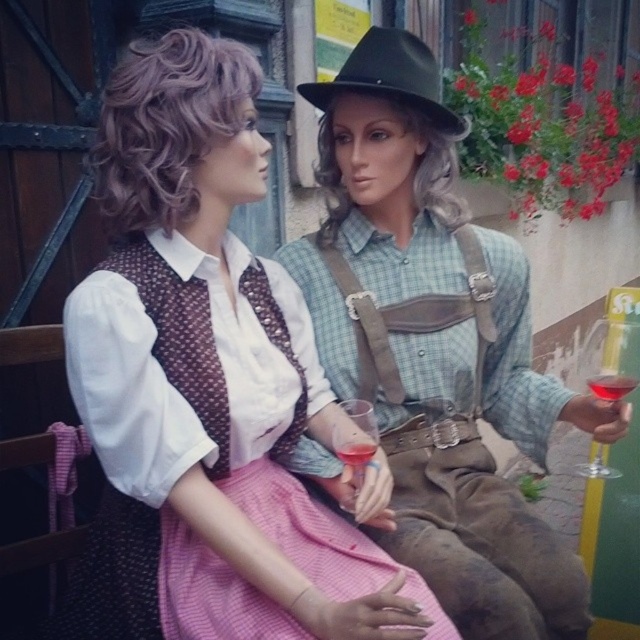
Question: From the image, what is the correct spatial relationship of matte white blouse at center in relation to brown leather suspenders at center?

Choices:
 (A) left
 (B) right

Answer: (A)

Question: Is matte white blouse at center wider than purple curly wig at upper left?

Choices:
 (A) yes
 (B) no

Answer: (A)

Question: Which point is closer to the camera?

Choices:
 (A) (150, 128)
 (B) (611, 348)
 (C) (547, 573)
 (D) (408, 221)

Answer: (A)

Question: Which is farther from the translucent glass wine at right?

Choices:
 (A) matte green shirt at center
 (B) translucent glass wine at center

Answer: (B)

Question: Is the position of gray synthetic wig at center more distant than that of translucent glass wine glass at right?

Choices:
 (A) yes
 (B) no

Answer: (A)

Question: Which point appears closest to the camera in this image?

Choices:
 (A) (586, 385)
 (B) (355, 467)
 (C) (160, 134)
 (D) (88, 433)

Answer: (D)